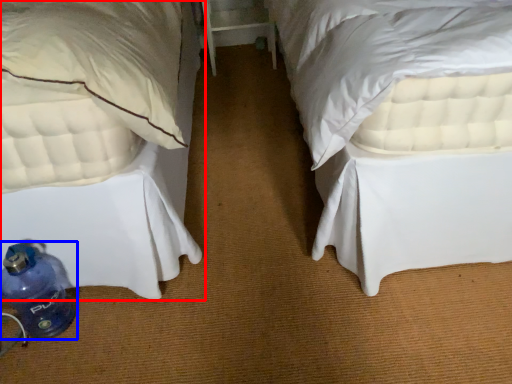
Question: Among these objects, which one is farthest to the camera, bed (highlighted by a red box) or bottle (highlighted by a blue box)?

Choices:
 (A) bed
 (B) bottle

Answer: (B)